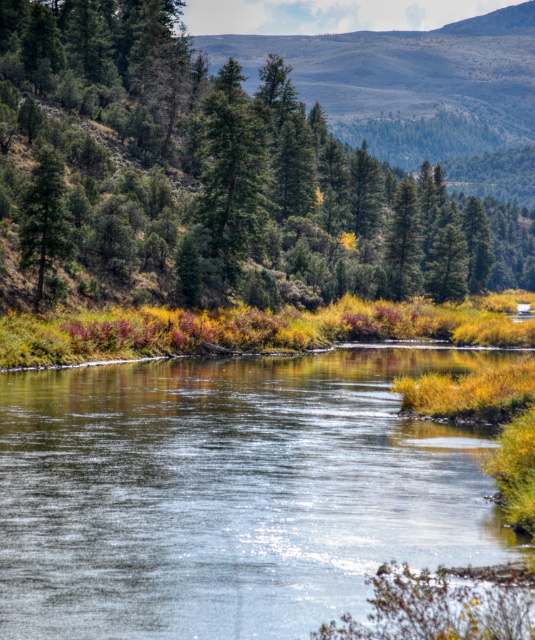
Which is in front, point (531, 237) or point (21, 220)?

Point (21, 220)

Is green matte tree at upper center thinner than green matte tree at left?

No.

Is point (49, 288) closer to viewer compared to point (55, 196)?

No, it is behind (55, 196).

Locate an element on the screen. This screenshot has height=640, width=535. green matte tree at upper center is located at coordinates (256, 157).

Between clear water at center and green matte tree at left, which one is positioned higher?

green matte tree at left

Does point (431, 502) come farther from viewer compared to point (33, 234)?

That is False.

Which is in front, point (40, 436) or point (30, 177)?

Point (40, 436)

At what (x,y) coordinates should I click in order to perform the action: click on clear water at center. Please return your answer as a coordinate pair (x, y). The image size is (535, 640). Looking at the image, I should click on (231, 492).

Measure the distance between green matte tree at upper center and clear water at center.

A distance of 103.53 meters exists between green matte tree at upper center and clear water at center.

Who is lower down, green matte tree at upper center or clear water at center?

clear water at center

The height and width of the screenshot is (640, 535). Describe the element at coordinates (256, 157) in the screenshot. I see `green matte tree at upper center` at that location.

This screenshot has height=640, width=535. I want to click on green matte tree at upper center, so click(x=256, y=157).